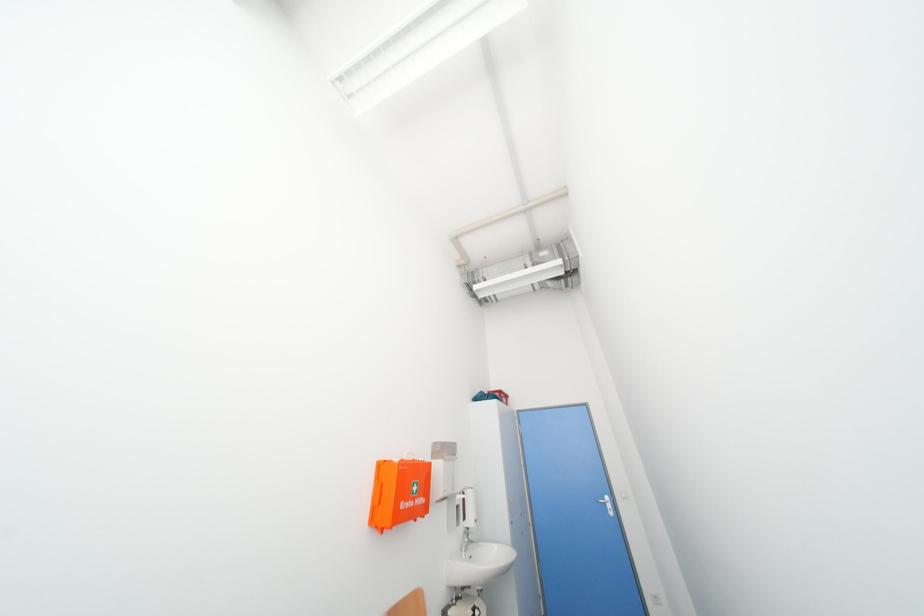
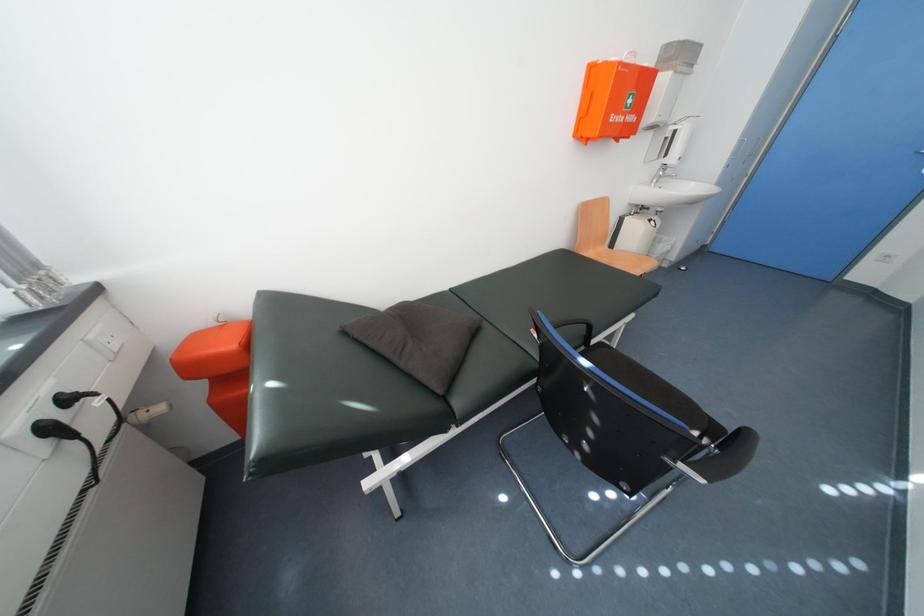
The first image is from the beginning of the video and the second image is from the end. How did the camera likely rotate when shooting the video?

The camera rotated toward left-down.